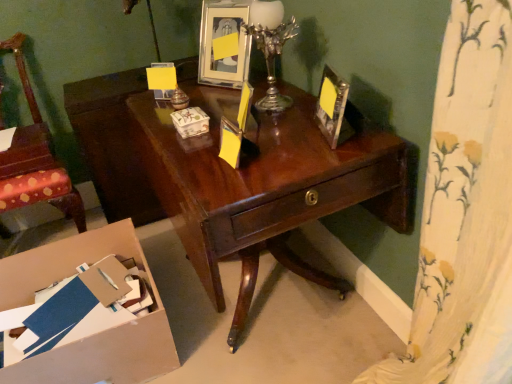
Find the location of a particular element. This screenshot has width=512, height=384. wooden chair at left is located at coordinates (35, 159).

I want to click on shiny dark wood desk at center, so click(x=232, y=175).

Locate an element on the screen. Image resolution: width=512 pixels, height=384 pixels. metallic silver picture frame at upper center, positioned as the second picture frame in right-to-left order is located at coordinates (222, 36).

Describe the element at coordinates (93, 335) in the screenshot. I see `cardboard box at lower left` at that location.

Find the location of a particular element. metallic silver picture frame at upper right, the second picture frame positioned from the back is located at coordinates (333, 108).

Is silver metallic candle holder at upper right shorter than cardboard box at lower left?

No.

Does silver metallic candle holder at upper right come in front of cardboard box at lower left?

No, it is not.

The width and height of the screenshot is (512, 384). In the image, there is a silver metallic candle holder at upper right. What are the coordinates of `cardboard box below it (from a real-world perspective)` in the screenshot? It's located at (93, 335).

Is wooden chair at left far from metallic silver picture frame at upper right, arranged as the first picture frame when viewed from the right?

Yes, wooden chair at left is far from metallic silver picture frame at upper right, arranged as the first picture frame when viewed from the right.

Considering the positions of objects wooden chair at left and metallic silver picture frame at upper right, the 2th picture frame positioned from the left, in the image provided, who is more to the right, wooden chair at left or metallic silver picture frame at upper right, the 2th picture frame positioned from the left,?

metallic silver picture frame at upper right, the 2th picture frame positioned from the left.

Is wooden chair at left positioned behind metallic silver picture frame at upper right, arranged as the first picture frame when viewed from the front?

Yes, it is behind metallic silver picture frame at upper right, arranged as the first picture frame when viewed from the front.

Based on their sizes in the image, would you say wooden chair at left is bigger or smaller than metallic silver picture frame at upper right, arranged as the first picture frame when viewed from the right?

wooden chair at left is bigger than metallic silver picture frame at upper right, arranged as the first picture frame when viewed from the right.

Is silver metallic candle holder at upper right looking in the opposite direction of wooden chair at left?

No.

Which is behind, silver metallic candle holder at upper right or wooden chair at left?

wooden chair at left is further from the camera.

Considering the relative sizes of silver metallic candle holder at upper right and wooden chair at left in the image provided, is silver metallic candle holder at upper right taller than wooden chair at left?

Incorrect, the height of silver metallic candle holder at upper right is not larger of that of wooden chair at left.

Is silver metallic candle holder at upper right far away from wooden chair at left?

Yes.

Is wooden chair at left directly adjacent to silver metallic candle holder at upper right?

There is a gap between wooden chair at left and silver metallic candle holder at upper right.

Which of these two, wooden chair at left or silver metallic candle holder at upper right, is bigger?

Bigger between the two is wooden chair at left.

Measure the distance between wooden chair at left and silver metallic candle holder at upper right.

wooden chair at left and silver metallic candle holder at upper right are 1.05 meters apart from each other.

Is wooden chair at left wider than silver metallic candle holder at upper right?

Yes.

How different are the orientations of matte ceramic box at center and shiny dark wood desk at center in degrees?

0.381 degrees.

Does matte ceramic box at center lie in front of shiny dark wood desk at center?

No.

Is point (196, 127) closer to camera compared to point (249, 199)?

No, it is not.

From a real-world perspective, is matte ceramic box at center under shiny dark wood desk at center?

Incorrect, from a real-world perspective, matte ceramic box at center is higher than shiny dark wood desk at center.

How many degrees apart are the facing directions of cardboard box at lower left and shiny dark wood desk at center?

The angle between the facing direction of cardboard box at lower left and the facing direction of shiny dark wood desk at center is 90.1 degrees.

Which of these two, cardboard box at lower left or shiny dark wood desk at center, is wider?

cardboard box at lower left is wider.

Based on the photo, is cardboard box at lower left looking in the opposite direction of shiny dark wood desk at center?

cardboard box at lower left does not have its back to shiny dark wood desk at center.

Considering the positions of objects cardboard box at lower left and shiny dark wood desk at center in the image provided, who is more to the right, cardboard box at lower left or shiny dark wood desk at center?

shiny dark wood desk at center.

Can you confirm if metallic silver picture frame at upper center, the first picture frame when ordered from top to bottom, is taller than matte ceramic box at center?

Yes.

Is metallic silver picture frame at upper center, which is the first picture frame in left-to-right order, aimed at matte ceramic box at center?

Yes, metallic silver picture frame at upper center, which is the first picture frame in left-to-right order, faces towards matte ceramic box at center.

Between metallic silver picture frame at upper center, the first picture frame when ordered from top to bottom, and matte ceramic box at center, which one has smaller width?

With smaller width is matte ceramic box at center.

Considering the relative sizes of metallic silver picture frame at upper center, the first picture frame when ordered from top to bottom, and matte ceramic box at center in the image provided, is metallic silver picture frame at upper center, the first picture frame when ordered from top to bottom, smaller than matte ceramic box at center?

Actually, metallic silver picture frame at upper center, the first picture frame when ordered from top to bottom, might be larger than matte ceramic box at center.

The height and width of the screenshot is (384, 512). Find the location of `candle holder behind the cardboard box at lower left`. candle holder behind the cardboard box at lower left is located at coordinates (270, 46).

The height and width of the screenshot is (384, 512). Identify the location of chair below the metallic silver picture frame at upper right, acting as the second picture frame starting from the top (from a real-world perspective). (35, 159).

Based on their spatial positions, is shiny dark wood desk at center or silver metallic candle holder at upper right closer to matte ceramic box at center?

silver metallic candle holder at upper right is closer to matte ceramic box at center.

Based on their spatial positions, is matte ceramic box at center or metallic silver picture frame at upper right, the 2th picture frame positioned from the left, closer to wooden chair at left?

matte ceramic box at center is closer to wooden chair at left.

Which object lies further to the anchor point cardboard box at lower left, silver metallic candle holder at upper right or wooden chair at left?

silver metallic candle holder at upper right.

Consider the image. Considering their positions, is silver metallic candle holder at upper right positioned further to wooden chair at left than shiny dark wood desk at center?

silver metallic candle holder at upper right is further to wooden chair at left.

When comparing their distances from metallic silver picture frame at upper center, which is the first picture frame in left-to-right order, does shiny dark wood desk at center or matte ceramic box at center seem further?

matte ceramic box at center is positioned further to the anchor metallic silver picture frame at upper center, which is the first picture frame in left-to-right order.

Which object lies further to the anchor point metallic silver picture frame at upper center, which is the first picture frame in left-to-right order, wooden chair at left or matte ceramic box at center?

The object further to metallic silver picture frame at upper center, which is the first picture frame in left-to-right order, is wooden chair at left.

When comparing their distances from metallic silver picture frame at upper right, the 1th picture frame from the bottom, does matte ceramic box at center or shiny dark wood desk at center seem further?

Among the two, shiny dark wood desk at center is located further to metallic silver picture frame at upper right, the 1th picture frame from the bottom.

Estimate the real-world distances between objects in this image. Which object is further from matte ceramic box at center, metallic silver picture frame at upper center, which is the second picture frame from bottom to top, or cardboard box at lower left?

cardboard box at lower left.

What are the coordinates of `picture frame between silver metallic candle holder at upper right and shiny dark wood desk at center vertically` in the screenshot? It's located at (333, 108).

Locate an element on the screen. The height and width of the screenshot is (384, 512). picture frame between metallic silver picture frame at upper center, the first picture frame when ordered from top to bottom, and cardboard box at lower left in the up-down direction is located at coordinates (333, 108).

Identify the location of box between wooden chair at left and metallic silver picture frame at upper center, which is the second picture frame from bottom to top, from left to right. (190, 122).

The width and height of the screenshot is (512, 384). In order to click on picture frame between wooden chair at left and metallic silver picture frame at upper right, the 2th picture frame positioned from the left, from left to right in this screenshot , I will do `click(222, 36)`.